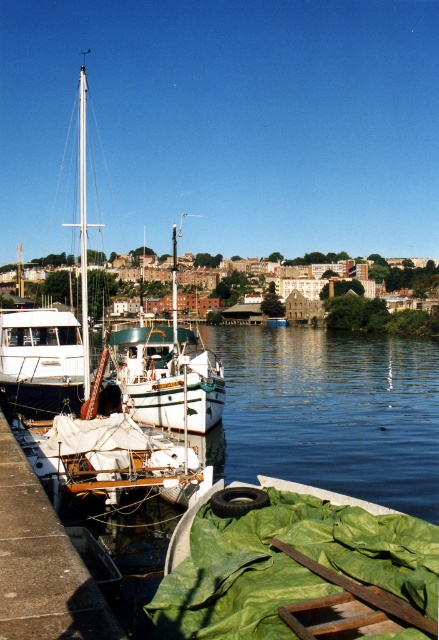
Does white matte sailboat at left have a lesser height compared to white glossy mast at left?

Yes.

Who is more forward, (53, 456) or (82, 282)?

Point (53, 456) is more forward.

Is point (150, 481) in front of point (83, 161)?

That is True.

This screenshot has height=640, width=439. What are the coordinates of `white matte sailboat at left` in the screenshot? It's located at (125, 401).

From the picture: Does white matte boat at center appear over white matte boat at left?

Yes.

Does white matte boat at center have a greater width compared to white matte boat at left?

Yes, white matte boat at center is wider than white matte boat at left.

Measure the distance between point (172, 289) and camera.

Point (172, 289) and camera are 119.32 meters apart.

Locate an element on the screen. Image resolution: width=439 pixels, height=640 pixels. white matte boat at center is located at coordinates (168, 372).

Can you confirm if white matte sailboat at left is positioned to the right of concrete dock at lower left?

No, white matte sailboat at left is not to the right of concrete dock at lower left.

Is white matte sailboat at left thinner than concrete dock at lower left?

Incorrect, white matte sailboat at left's width is not less than concrete dock at lower left's.

The height and width of the screenshot is (640, 439). I want to click on white matte sailboat at left, so click(x=125, y=401).